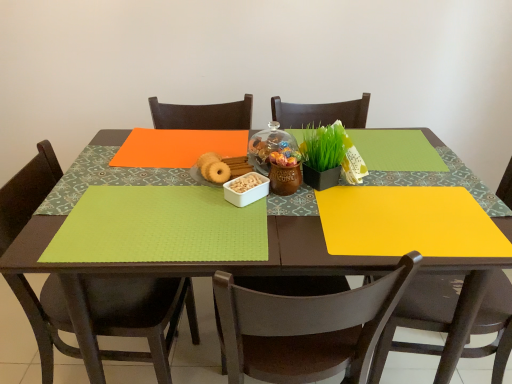
Question: Relative to matte brown chair at lower right, placed as the 3th chair when sorted from left to right, is green matte plant at center in front or behind?

Choices:
 (A) behind
 (B) front

Answer: (A)

Question: From a real-world perspective, is green matte plant at center above or below matte brown chair at lower right, placed as the 3th chair when sorted from left to right?

Choices:
 (A) below
 (B) above

Answer: (B)

Question: Which is nearer to the matte wood table at center?

Choices:
 (A) brown wooden chair at center, which is counted as the 2th chair, starting from the left
 (B) transparent glass jar at center
 (C) matte black chair at lower left, the first chair when ordered from left to right
 (D) matte brown chair at lower right, placed as the 3th chair when sorted from left to right
 (E) green matte plant at center

Answer: (A)

Question: Considering the real-world distances, which object is closest to the transparent glass jar at center?

Choices:
 (A) matte wood table at center
 (B) matte black chair at lower left, the first chair when ordered from left to right
 (C) lime green fabric placemat at lower left
 (D) matte brown chair at lower right, positioned as the 1th chair in right-to-left order
 (E) green matte plant at center

Answer: (E)